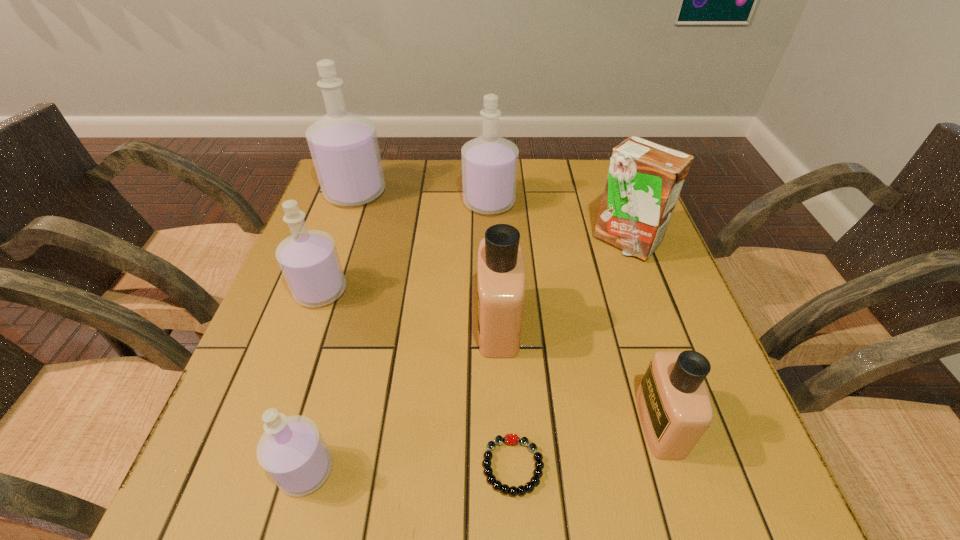
What are the coordinates of `object that is at the near left corner` in the screenshot? It's located at (x=292, y=451).

This screenshot has height=540, width=960. In order to click on free space at the far edge of the desktop in this screenshot , I will do `click(445, 176)`.

This screenshot has width=960, height=540. I want to click on vacant space at the near edge, so 637,500.

You are a GUI agent. You are given a task and a screenshot of the screen. Output one action in this format:
    pyautogui.click(x=<x>, y=<y>)
    Task: Click on the vacant space at the left edge of the desktop
    Image resolution: width=960 pixels, height=540 pixels.
    Given the screenshot: What is the action you would take?
    pyautogui.click(x=327, y=231)

Where is `vacant space at the right edge of the desktop`? This screenshot has height=540, width=960. vacant space at the right edge of the desktop is located at coordinates (637, 363).

Find the location of a particular element. The image size is (960, 540). free space at the near left corner is located at coordinates (220, 481).

Locate an element on the screen. The width and height of the screenshot is (960, 540). vacant region between the shortest object and the sixth nearest object is located at coordinates (569, 354).

Locate an element on the screen. This screenshot has height=540, width=960. vacant area that lies between the sixth nearest object and the second biggest purple perfume is located at coordinates (557, 222).

In order to click on vacant area that lies between the carton and the second smallest purple perfume in this screenshot , I will do `click(473, 266)`.

The image size is (960, 540). I want to click on vacant space that is in between the rightmost perfume and the carton, so click(642, 332).